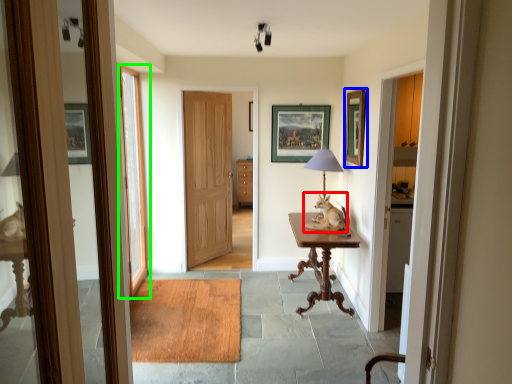
Question: Estimate the real-world distances between objects in this image. Which object is closer to open (highlighted by a red box), picture frame (highlighted by a blue box) or door (highlighted by a green box)?

Choices:
 (A) picture frame
 (B) door

Answer: (A)